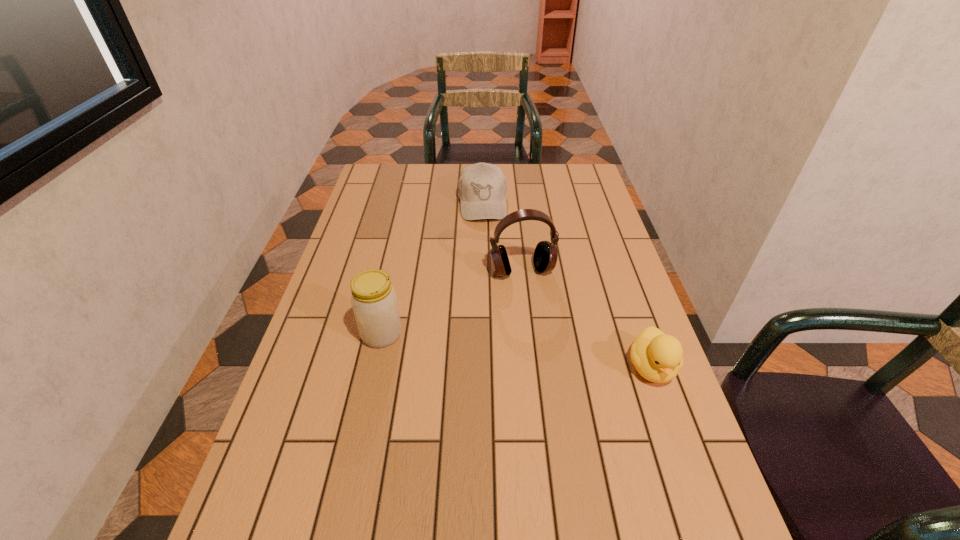
At what (x,y) coordinates should I click in order to perform the action: click on vacant space at the far right corner of the desktop. Please return your answer as a coordinate pair (x, y). Looking at the image, I should click on (583, 166).

The height and width of the screenshot is (540, 960). I want to click on vacant space that's between the duck and the jar, so click(516, 351).

This screenshot has width=960, height=540. I want to click on unoccupied position between the third nearest object and the jar, so click(x=452, y=302).

Find the location of `free space between the leftmost object and the rightmost object`. free space between the leftmost object and the rightmost object is located at coordinates (516, 351).

Find the location of `free space between the leftmost object and the baseball cap`. free space between the leftmost object and the baseball cap is located at coordinates (432, 268).

Where is `free space that is in between the farthest object and the rightmost object`? Image resolution: width=960 pixels, height=540 pixels. free space that is in between the farthest object and the rightmost object is located at coordinates (566, 285).

Locate an element on the screen. The width and height of the screenshot is (960, 540). empty space between the jar and the rightmost object is located at coordinates (516, 351).

Locate an element on the screen. vacant region between the third nearest object and the duck is located at coordinates (587, 319).

This screenshot has height=540, width=960. Find the location of `unoccupied position between the duck and the third nearest object`. unoccupied position between the duck and the third nearest object is located at coordinates (587, 319).

Identify the location of free space between the rightmost object and the headset. This screenshot has height=540, width=960. (587, 319).